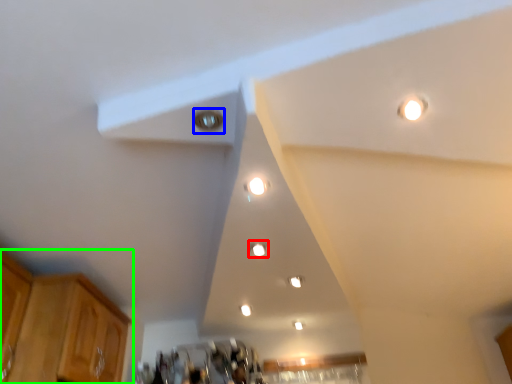
Question: Estimate the real-world distances between objects in this image. Which object is farther from dot (highlighted by a red box), light (highlighted by a blue box) or cabinetry (highlighted by a green box)?

Choices:
 (A) light
 (B) cabinetry

Answer: (B)